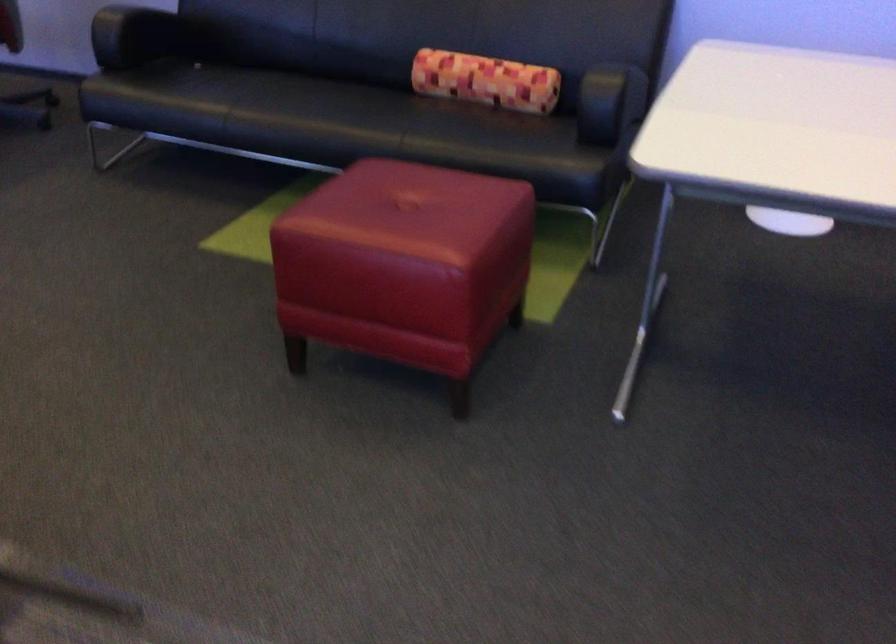
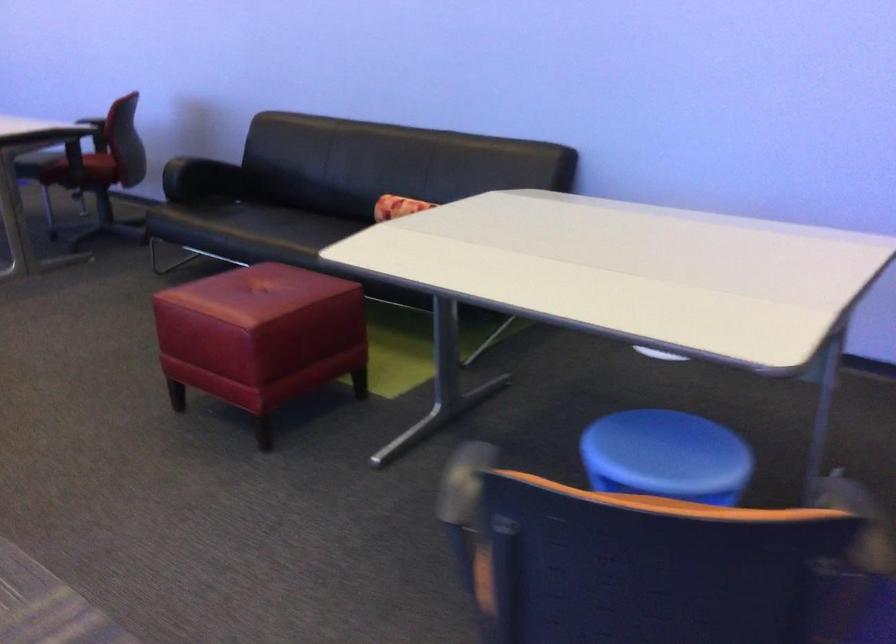
In the second image, find the point that corresponds to [467,269] in the first image.

(261, 337)